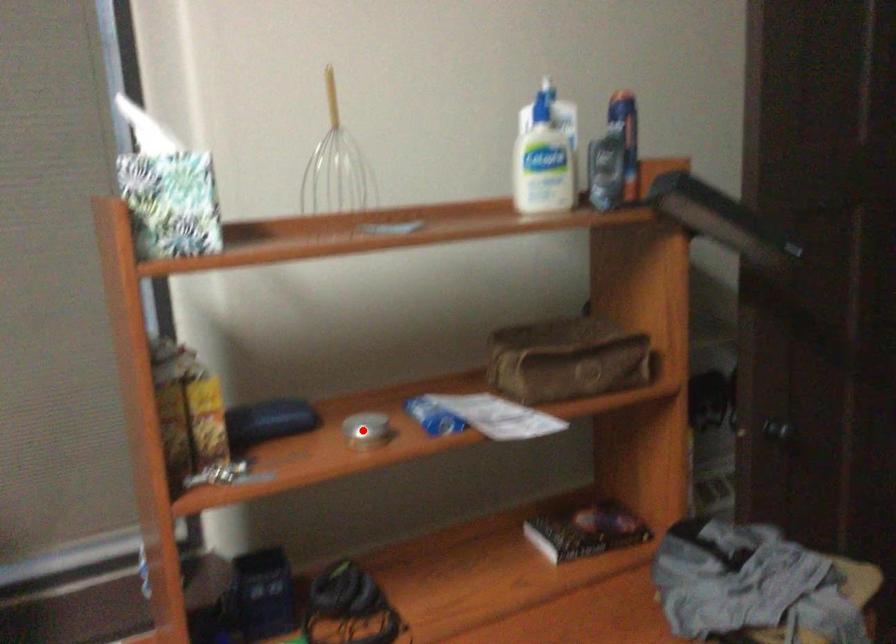
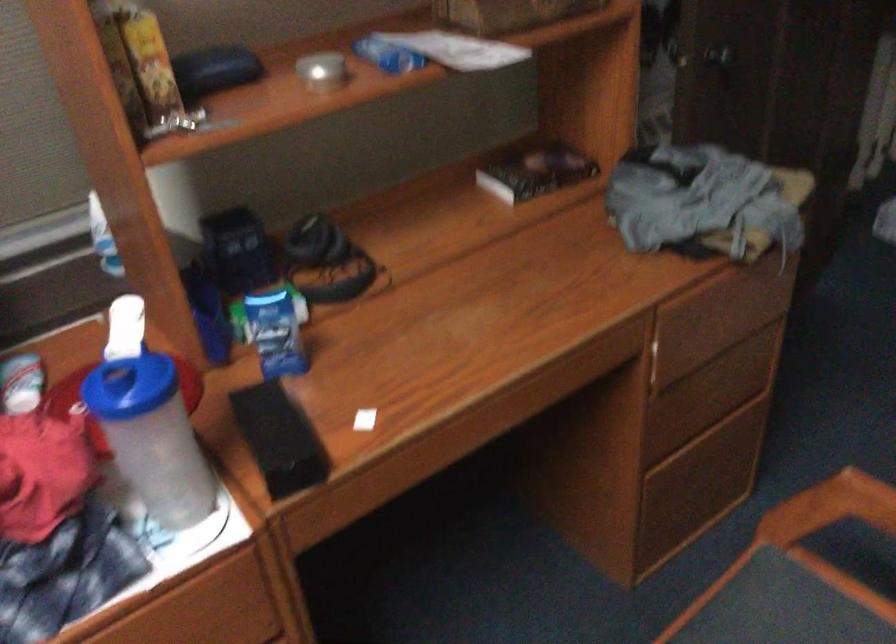
Where in the second image is the point corresponding to the highlighted location from the first image?

(322, 71)